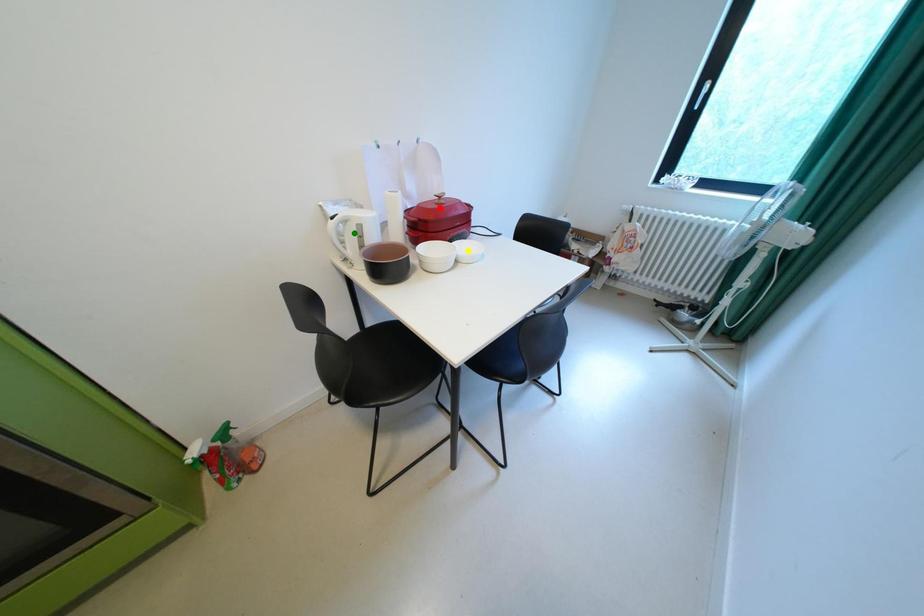
Order these from nearest to farthest:
1. green point
2. yellow point
3. red point

1. green point
2. yellow point
3. red point